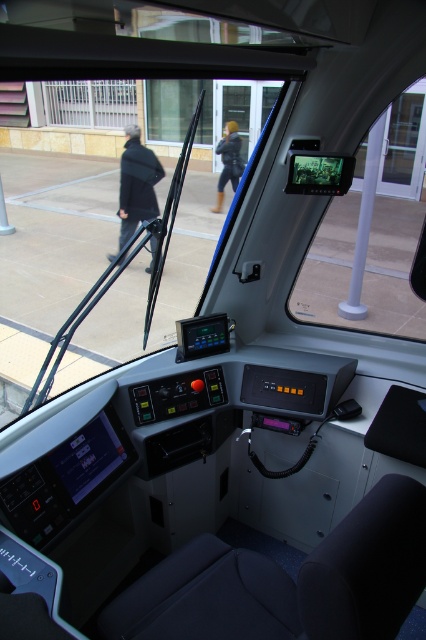
Is transparent glass monitor at upper center wider than black matte coat at left?

No.

Is transparent glass monitor at upper center to the right of black matte coat at left from the viewer's perspective?

Yes, transparent glass monitor at upper center is to the right of black matte coat at left.

This screenshot has width=426, height=640. Describe the element at coordinates (374, 234) in the screenshot. I see `transparent glass monitor at upper center` at that location.

The width and height of the screenshot is (426, 640). In order to click on transparent glass monitor at upper center in this screenshot , I will do `click(374, 234)`.

Does metallic bars at upper left appear under black matte coat at left?

Incorrect, metallic bars at upper left is not positioned below black matte coat at left.

Who is higher up, metallic bars at upper left or black matte coat at left?

metallic bars at upper left is higher up.

Identify the location of metallic bars at upper left. (89, 102).

Can you confirm if transparent glass monitor at upper center is wider than metallic bars at upper left?

No.

Does transparent glass monitor at upper center appear over metallic bars at upper left?

Incorrect, transparent glass monitor at upper center is not positioned above metallic bars at upper left.

Locate an element on the screen. transparent glass monitor at upper center is located at coordinates (374, 234).